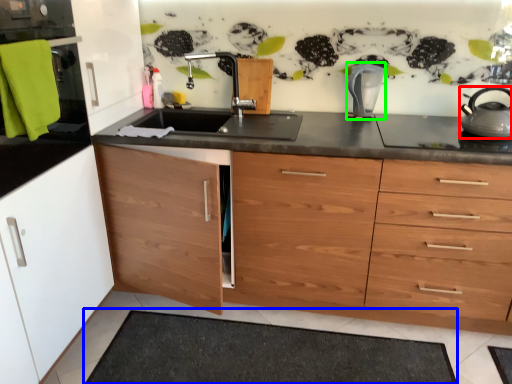
Question: Estimate the real-world distances between objects in this image. Which object is farther from home appliance (highlighted by a red box), bath mat (highlighted by a blue box) or kitchen appliance (highlighted by a green box)?

Choices:
 (A) bath mat
 (B) kitchen appliance

Answer: (A)